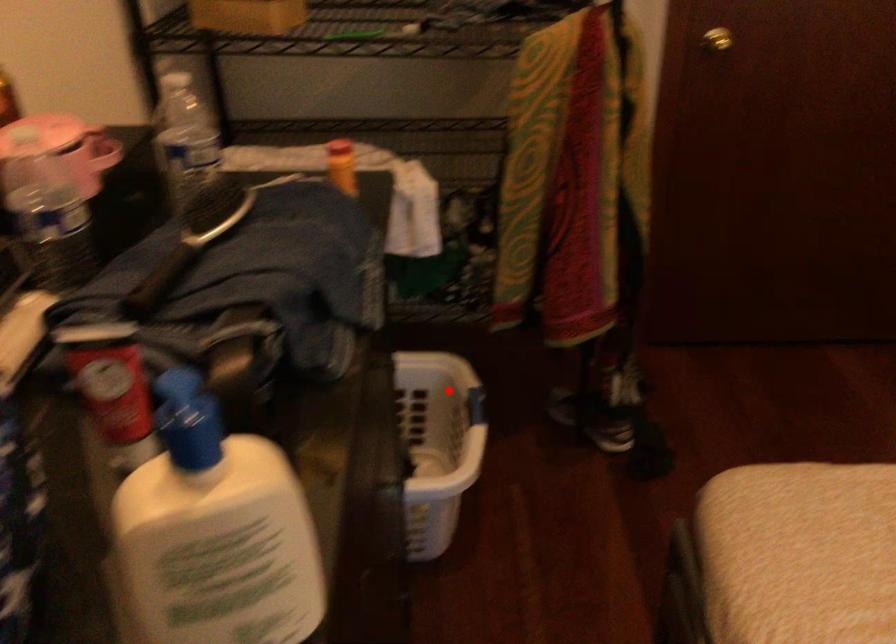
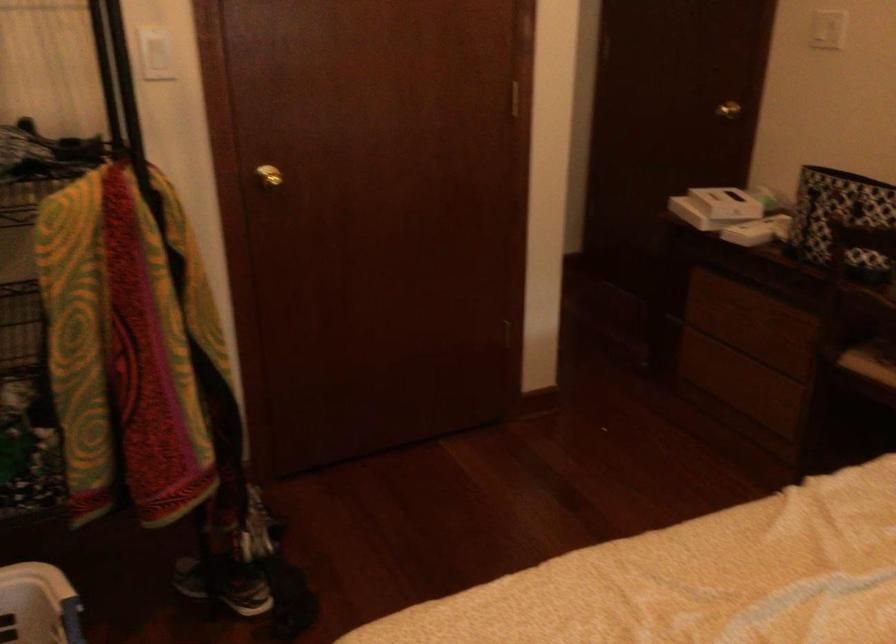
Locate, in the second image, the point that corresponds to the highlighted location in the first image.

(38, 605)